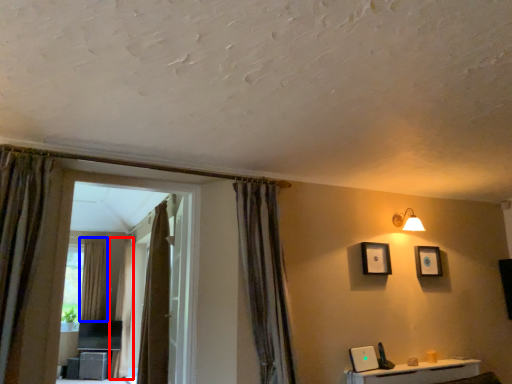
Question: Which of the following is the closest to the observer, curtain (highlighted by a red box) or curtain (highlighted by a blue box)?

Choices:
 (A) curtain
 (B) curtain

Answer: (A)